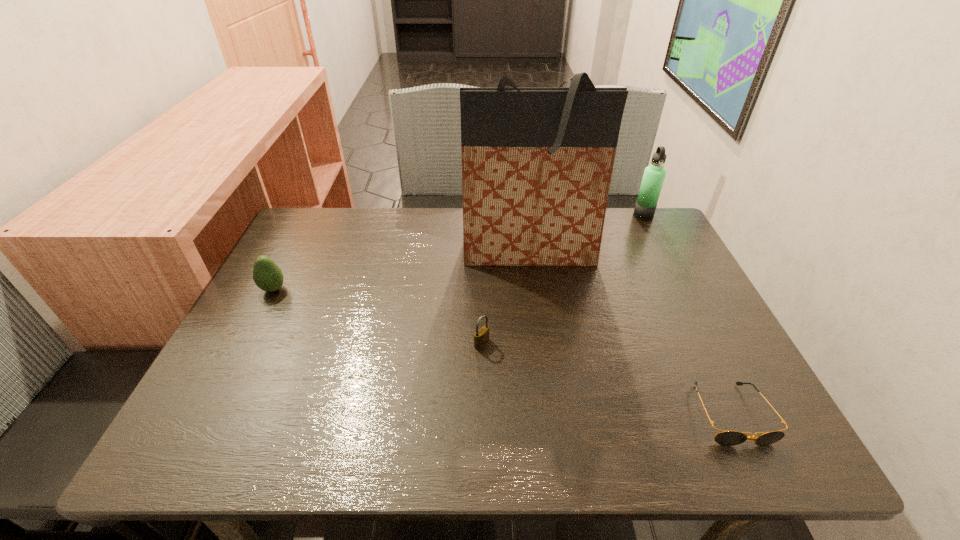
The width and height of the screenshot is (960, 540). I want to click on the tallest object, so click(x=537, y=163).

The image size is (960, 540). I want to click on the second farthest object, so click(537, 163).

At what (x,y) coordinates should I click in order to perform the action: click on thermos bottle. Please return your answer as a coordinate pair (x, y). Looking at the image, I should click on (654, 175).

At what (x,y) coordinates should I click in order to perform the action: click on the farthest object. Please return your answer as a coordinate pair (x, y). The width and height of the screenshot is (960, 540). Looking at the image, I should click on (654, 175).

This screenshot has width=960, height=540. In order to click on the leftmost object in this screenshot , I will do `click(267, 275)`.

Where is `avocado`? The width and height of the screenshot is (960, 540). avocado is located at coordinates (267, 275).

Where is `the fourth tallest object`? This screenshot has height=540, width=960. the fourth tallest object is located at coordinates (481, 337).

You are a GUI agent. You are given a task and a screenshot of the screen. Output one action in this format:
    pyautogui.click(x=<x>, y=<y>)
    Task: Click on the second nearest object
    The image size is (960, 540).
    Given the screenshot: What is the action you would take?
    pyautogui.click(x=481, y=337)

You are a GUI agent. You are given a task and a screenshot of the screen. Output one action in this format:
    pyautogui.click(x=<x>, y=<y>)
    Task: Click on the sunglasses
    The image size is (960, 540).
    Given the screenshot: What is the action you would take?
    pyautogui.click(x=728, y=438)

Where is `the shortest object`? Image resolution: width=960 pixels, height=540 pixels. the shortest object is located at coordinates (728, 438).